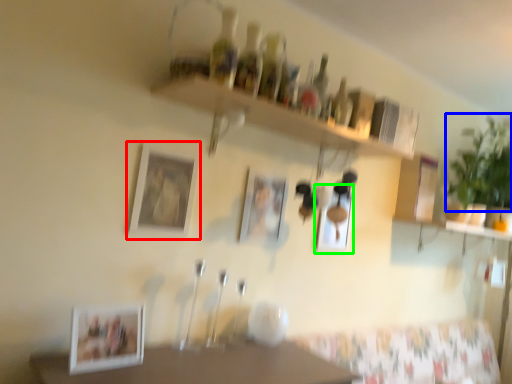
Question: Which is farther away from picture frame (highlighted by a red box)? plant (highlighted by a blue box) or picture frame (highlighted by a green box)?

Choices:
 (A) plant
 (B) picture frame

Answer: (A)